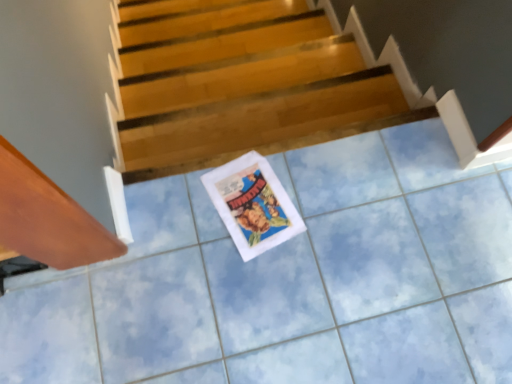
You are a GUI agent. You are given a task and a screenshot of the screen. Output one action in this format:
    pyautogui.click(x=<x>, y=<y>)
    Task: Click on the blank space situated above wooden stairs at center (from a real-world perspective)
    The height and width of the screenshot is (384, 512).
    Given the screenshot: What is the action you would take?
    pyautogui.click(x=272, y=114)